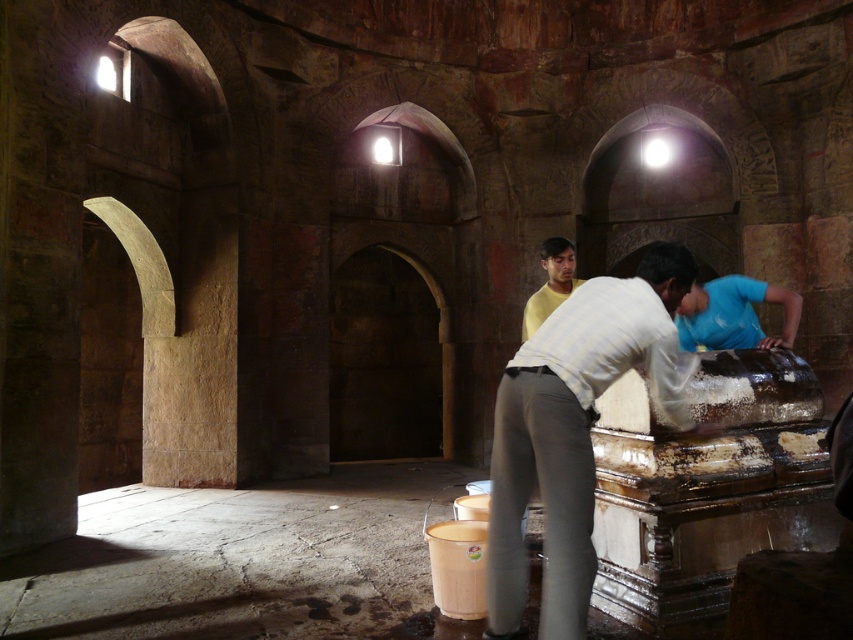
In the scene shown: You are standing in the historical structure and need to choose between placing a small decorative item on either the white matte shirt at center or the blue cotton shirt at lower right. Which surface can accommodate a wider item?

The blue cotton shirt at lower right has a greater width compared to the white matte shirt at center, so it can accommodate a wider item.